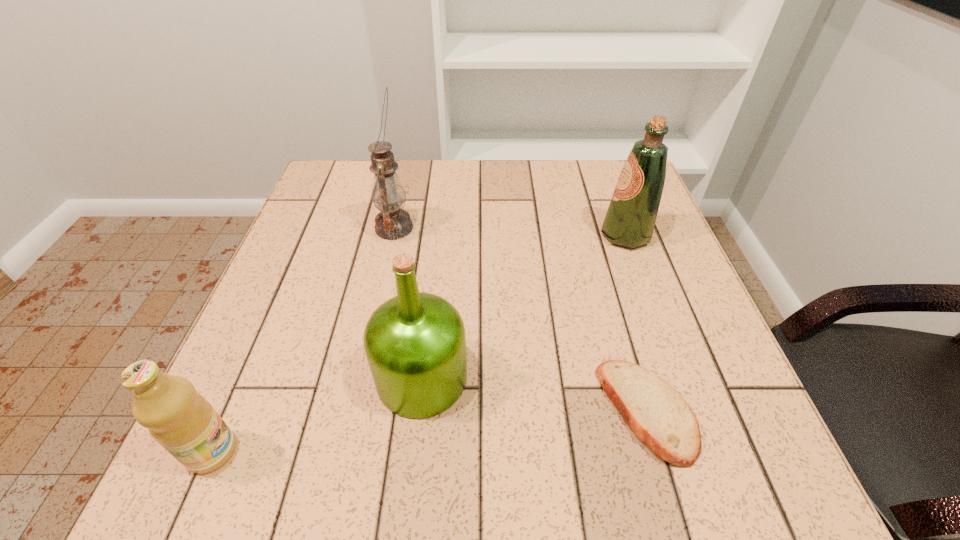
The image size is (960, 540). I want to click on vacant space located 0.260m on the right of the second nearest olive oil, so 617,377.

I want to click on vacant space situated on the label of the leftmost olive oil, so click(407, 451).

Locate an element on the screen. The width and height of the screenshot is (960, 540). blank area located 0.210m on the back of the pita bread is located at coordinates (609, 279).

At what (x,y) coordinates should I click in order to perform the action: click on olive oil that is at the near edge. Please return your answer as a coordinate pair (x, y). Looking at the image, I should click on (181, 420).

I want to click on pita bread situated at the near edge, so click(657, 413).

Image resolution: width=960 pixels, height=540 pixels. Find the location of `object that is at the left edge`. object that is at the left edge is located at coordinates (181, 420).

Identify the location of olive oil located in the right edge section of the desktop. The image size is (960, 540). (630, 219).

This screenshot has height=540, width=960. In order to click on pita bread positioned at the right edge in this screenshot , I will do `click(657, 413)`.

Where is `object situated at the near left corner`? object situated at the near left corner is located at coordinates (181, 420).

Find the location of a particular element. object that is at the near right corner is located at coordinates (657, 413).